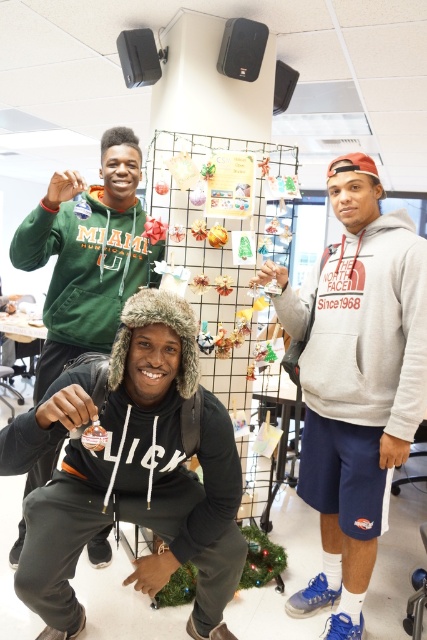
You are organizing a costume party and need to decide which item takes up more space horizontally. Based on the scene, which object is wider between the black fuzzy hat at lower left and the gray fleece hoodie at center?

The black fuzzy hat at lower left is wider than the gray fleece hoodie at center according to the description.

You are observing a group of people in a classroom. You notice the black fuzzy hat at lower left and the gray fleece hoodie at center. Which object is taller?

The gray fleece hoodie at center is taller than the black fuzzy hat at lower left.